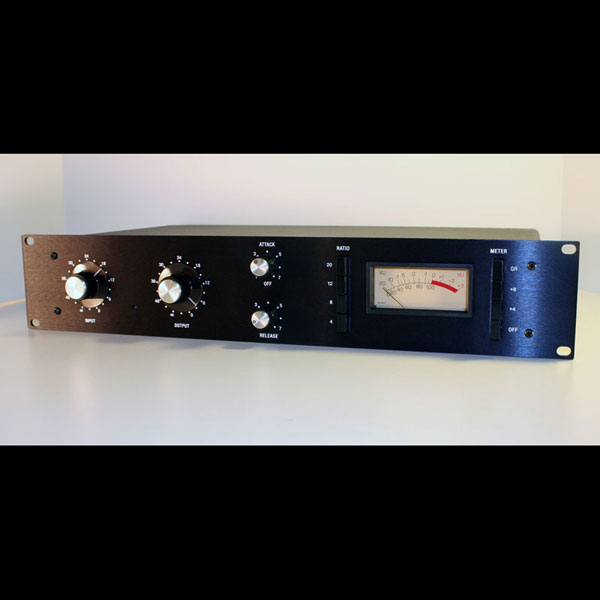
At what (x,y) coordinates should I click in order to perform the action: click on large knobs. Please return your answer as a coordinate pair (x, y). Looking at the image, I should click on (168, 297), (82, 296).